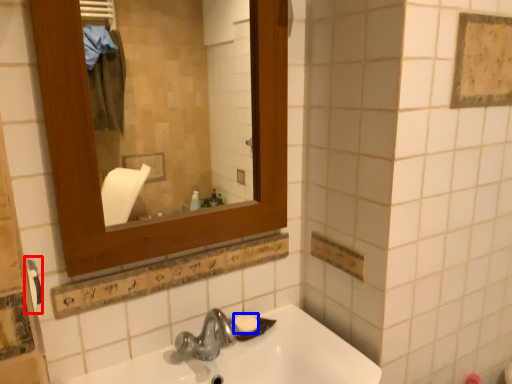
Question: Which of the following is the closest to the observer, towel bar (highlighted by a red box) or soap (highlighted by a blue box)?

Choices:
 (A) towel bar
 (B) soap

Answer: (A)